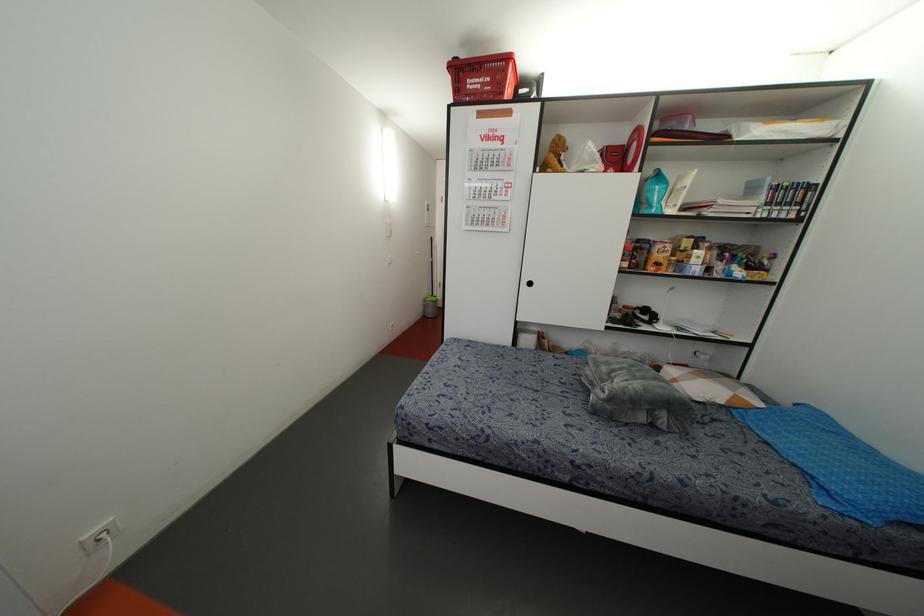
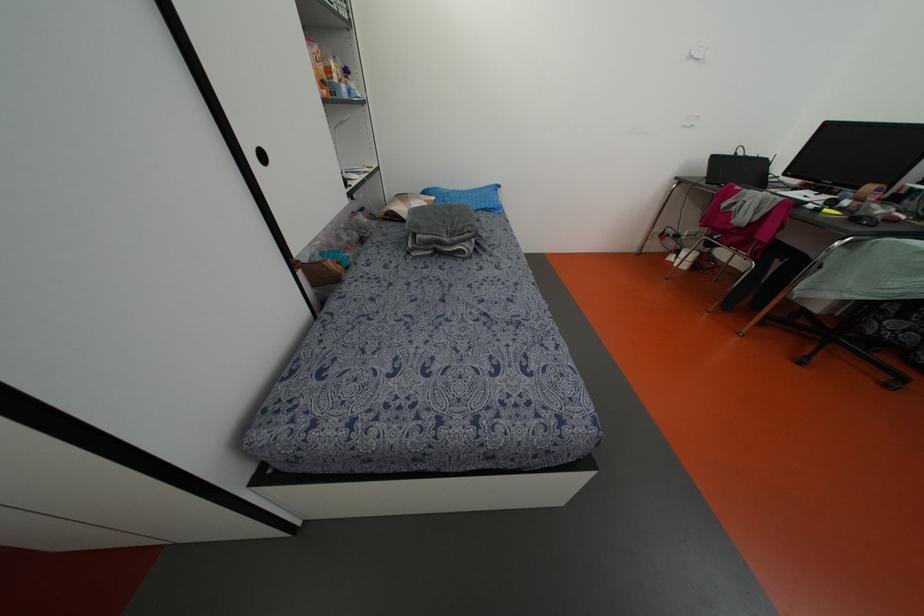
The point at [529,283] is marked in the first image. Where is the corresponding point in the second image?

(262, 156)